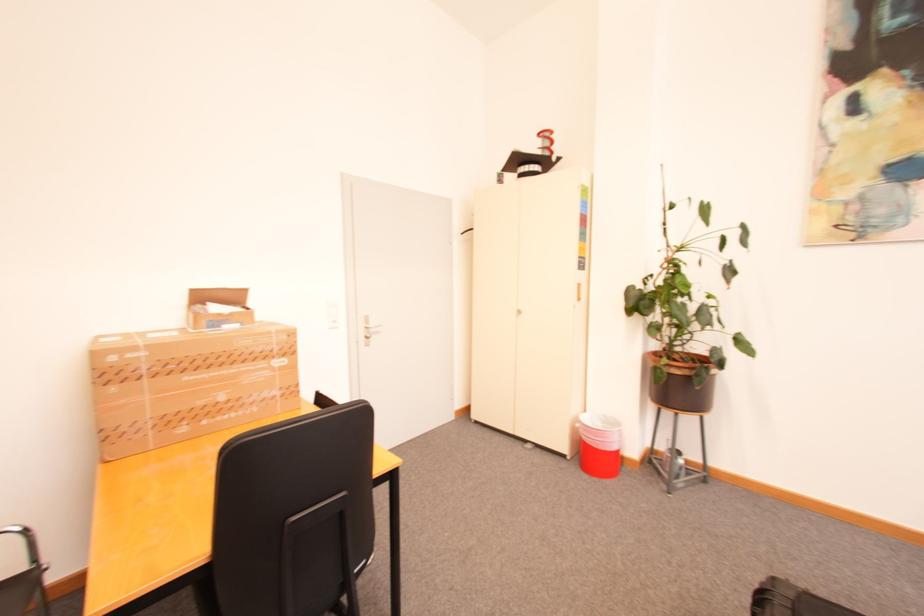
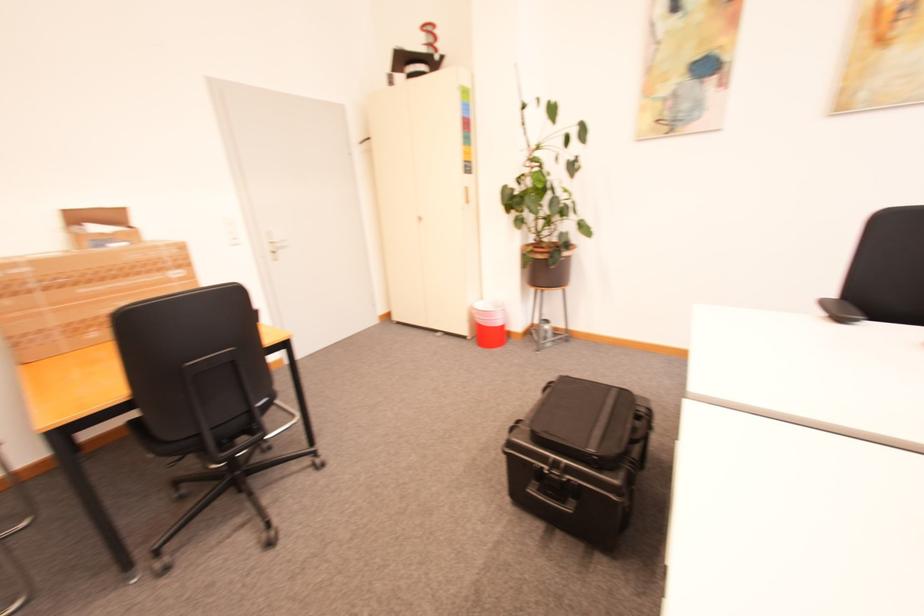
The point at [372,329] is marked in the first image. Where is the corresponding point in the second image?

(277, 244)